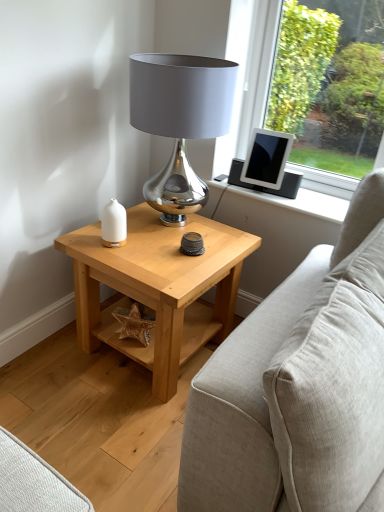
Question: Would you say light wood/texture side table at center is inside or outside shiny metallic lamp at center?

Choices:
 (A) inside
 (B) outside

Answer: (B)

Question: Relative to shiny metallic lamp at center, is light wood/texture side table at center in front or behind?

Choices:
 (A) front
 (B) behind

Answer: (B)

Question: Estimate the real-world distances between objects in this image. Which object is farther from the matte black tablet at upper right?

Choices:
 (A) light wood/texture side table at center
 (B) white matte candle holder at left
 (C) shiny metallic lamp at center
 (D) beige fabric couch at right

Answer: (D)

Question: Which object is the farthest from the beige fabric couch at right?

Choices:
 (A) shiny metallic lamp at center
 (B) light wood/texture side table at center
 (C) white matte candle holder at left
 (D) matte black tablet at upper right

Answer: (D)